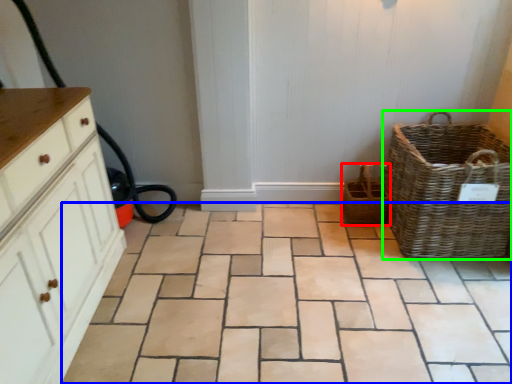
Question: Which object is positioned closest to basket (highlighted by a red box)? Select from ceramic tile (highlighted by a blue box) and picnic basket (highlighted by a green box).

Choices:
 (A) ceramic tile
 (B) picnic basket

Answer: (B)